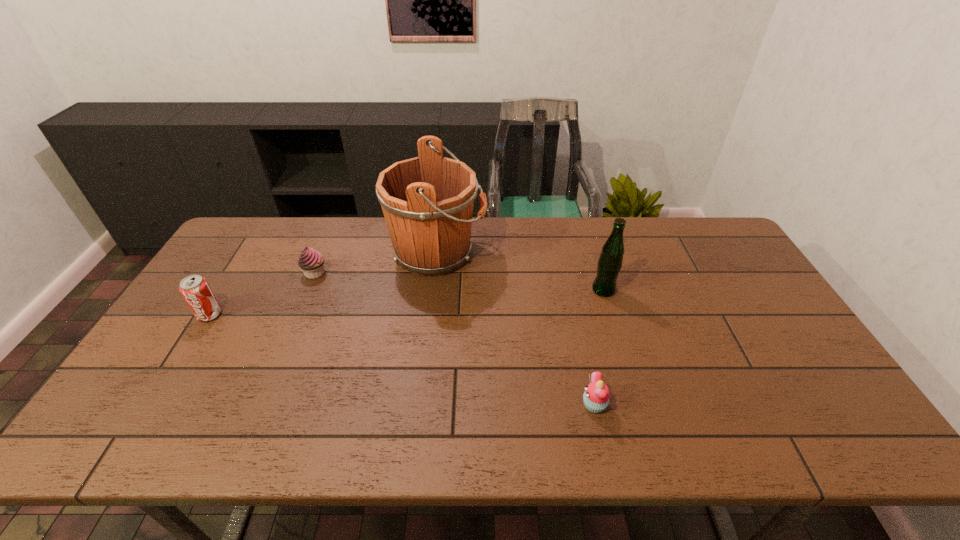
Locate an element on the screen. The image size is (960, 540). unoccupied position between the bucket and the rightmost object is located at coordinates (520, 272).

The image size is (960, 540). What are the coordinates of `vacant point located between the soda can and the second object from right to left` in the screenshot? It's located at (402, 360).

The width and height of the screenshot is (960, 540). What are the coordinates of `free spot between the fourth farthest object and the nearer cupcake` in the screenshot? It's located at (402, 360).

You are a GUI agent. You are given a task and a screenshot of the screen. Output one action in this format:
    pyautogui.click(x=<x>, y=<y>)
    Task: Click on the vacant space in between the third object from left to right and the nearest object
    This screenshot has height=540, width=960.
    Given the screenshot: What is the action you would take?
    pyautogui.click(x=516, y=329)

I want to click on the fourth closest object relative to the fourth shortest object, so click(x=195, y=289).

The height and width of the screenshot is (540, 960). Identify the location of object that is the second closest to the left cupcake. (195, 289).